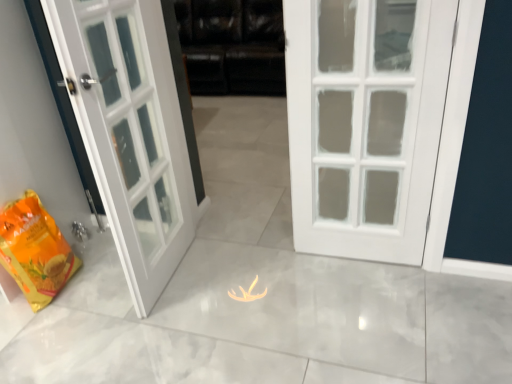
Question: From their relative heights in the image, would you say black leather couch at center is taller or shorter than yellow matte shopping bag at lower left?

Choices:
 (A) short
 (B) tall

Answer: (B)

Question: From a real-world perspective, relative to yellow matte shopping bag at lower left, is black leather couch at center vertically above or below?

Choices:
 (A) below
 (B) above

Answer: (B)

Question: Based on their sizes in the image, would you say black leather couch at center is bigger or smaller than yellow matte shopping bag at lower left?

Choices:
 (A) big
 (B) small

Answer: (A)

Question: Considering the relative positions of yellow matte shopping bag at lower left and black leather couch at center in the image provided, is yellow matte shopping bag at lower left to the left or to the right of black leather couch at center?

Choices:
 (A) left
 (B) right

Answer: (A)

Question: In terms of width, does yellow matte shopping bag at lower left look wider or thinner when compared to black leather couch at center?

Choices:
 (A) wide
 (B) thin

Answer: (B)

Question: From the image's perspective, is yellow matte shopping bag at lower left above or below black leather couch at center?

Choices:
 (A) above
 (B) below

Answer: (B)

Question: In terms of size, does yellow matte shopping bag at lower left appear bigger or smaller than black leather couch at center?

Choices:
 (A) small
 (B) big

Answer: (A)